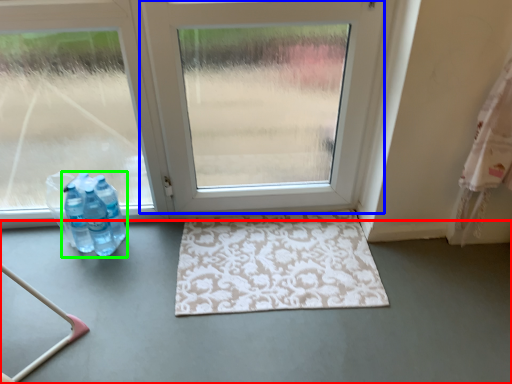
Question: Estimate the real-world distances between objects in this image. Which object is farther from concrete (highlighted by a red box), door (highlighted by a blue box) or bottle (highlighted by a green box)?

Choices:
 (A) door
 (B) bottle

Answer: (A)